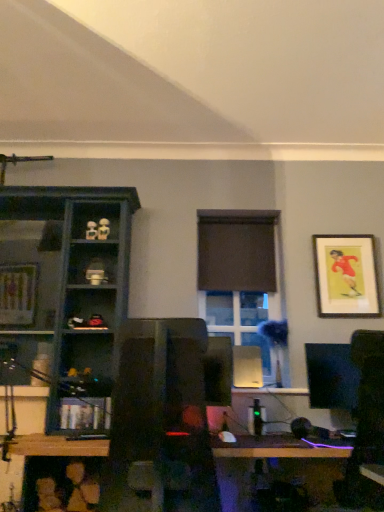
Question: Relative to matte white figurine at upper left, the 1th toy when ordered from right to left, is matte dark blue shelf at left, arranged as the first shelf when viewed from the top, in front or behind?

Choices:
 (A) front
 (B) behind

Answer: (A)

Question: In the image, is matte dark blue shelf at left, the 2th shelf ordered from the bottom, on the left side or the right side of matte white figurine at upper left, placed as the second toy when sorted from left to right?

Choices:
 (A) right
 (B) left

Answer: (B)

Question: Estimate the real-world distances between objects in this image. Which object is closer to the brown matte curtain at center?

Choices:
 (A) clear glass window at center
 (B) matte white figurine at upper left, acting as the 2th toy starting from the right
 (C) matte black monitor at right
 (D) matte white figurine at upper left, the 1th toy when ordered from right to left
 (E) wooden bookshelf at lower left, acting as the 1th shelf starting from the bottom

Answer: (A)

Question: Which is nearer to the matte black monitor at right?

Choices:
 (A) clear glass window at center
 (B) brown matte curtain at center
 (C) matte white figurine at upper left, the 1th toy when ordered from right to left
 (D) matte white figurine at upper left, acting as the 2th toy starting from the right
 (E) matte dark blue shelf at left, the 2th shelf ordered from the bottom

Answer: (A)